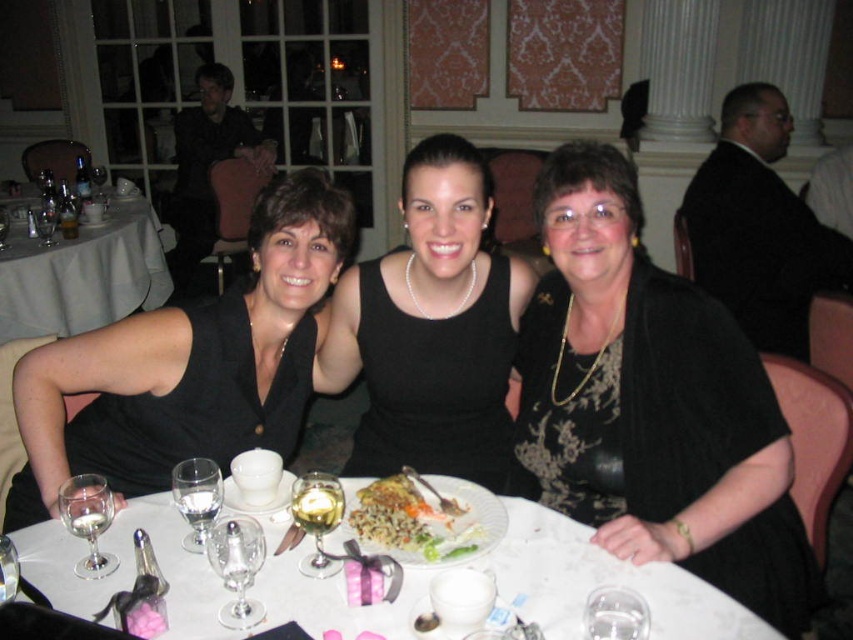
Question: Is white glossy plate at center above clear glass wine glass at center?

Choices:
 (A) yes
 (B) no

Answer: (B)

Question: Which object is farther from the camera taking this photo?

Choices:
 (A) transparent glass wine glass at table center
 (B) translucent glass wine glass at center
 (C) white cloth table at upper left
 (D) clear glass wine glass at lower left

Answer: (C)

Question: Can you confirm if golden brown omelette at center is wider than clear glass wine glass at center?

Choices:
 (A) yes
 (B) no

Answer: (A)

Question: Which point is farther from the camera taking this photo?

Choices:
 (A) click(509, 365)
 (B) click(178, 381)
 (C) click(618, 589)
 (D) click(15, 572)

Answer: (A)

Question: Is black lace dress at center below transparent glass wine glass at center?

Choices:
 (A) no
 (B) yes

Answer: (A)

Question: Which point is farther to the camera?

Choices:
 (A) clear glass wine glass at lower left
 (B) pearl necklace at center
 (C) translucent glass wine glass at center

Answer: (B)